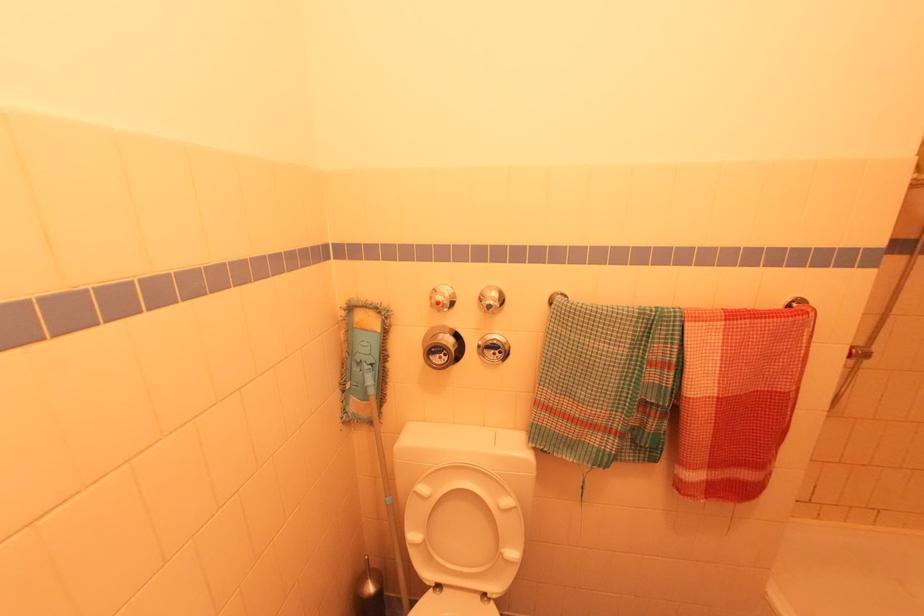
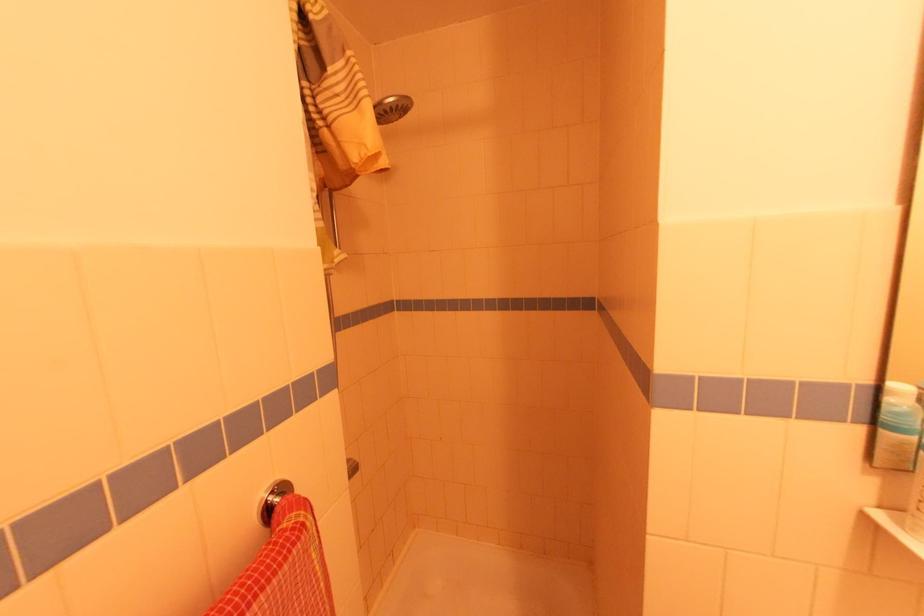
Question: The images are taken continuously from a first-person perspective. In which direction is your viewpoint rotating?

Choices:
 (A) Left
 (B) Right
 (C) Up
 (D) Down

Answer: (B)